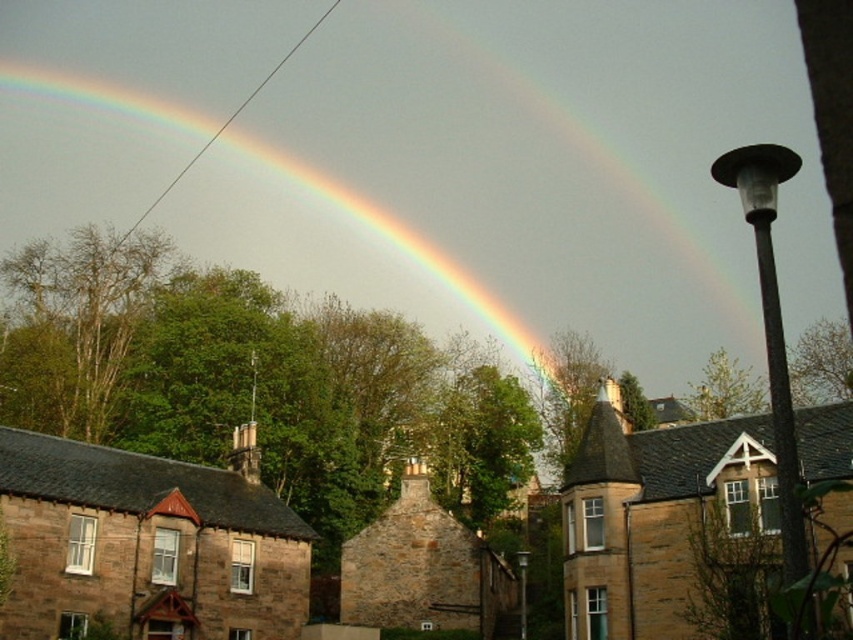
Question: Which object appears farthest from the camera in this image?

Choices:
 (A) rainbow at upper center
 (B) brown stone house at lower left

Answer: (A)

Question: Is rainbow at upper center in front of brown stone house at lower left?

Choices:
 (A) no
 (B) yes

Answer: (A)

Question: Which point is farther to the camera?

Choices:
 (A) brown stone house at lower left
 (B) rainbow at upper center

Answer: (B)

Question: Does rainbow at upper center have a larger size compared to brown stone house at lower left?

Choices:
 (A) no
 (B) yes

Answer: (B)

Question: Can you confirm if rainbow at upper center is thinner than brown stone house at lower left?

Choices:
 (A) no
 (B) yes

Answer: (A)